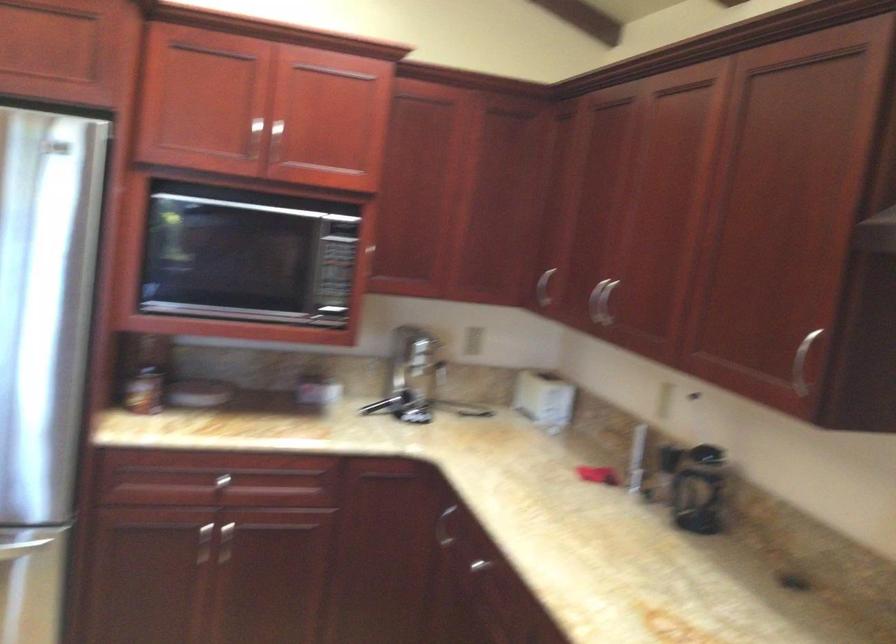
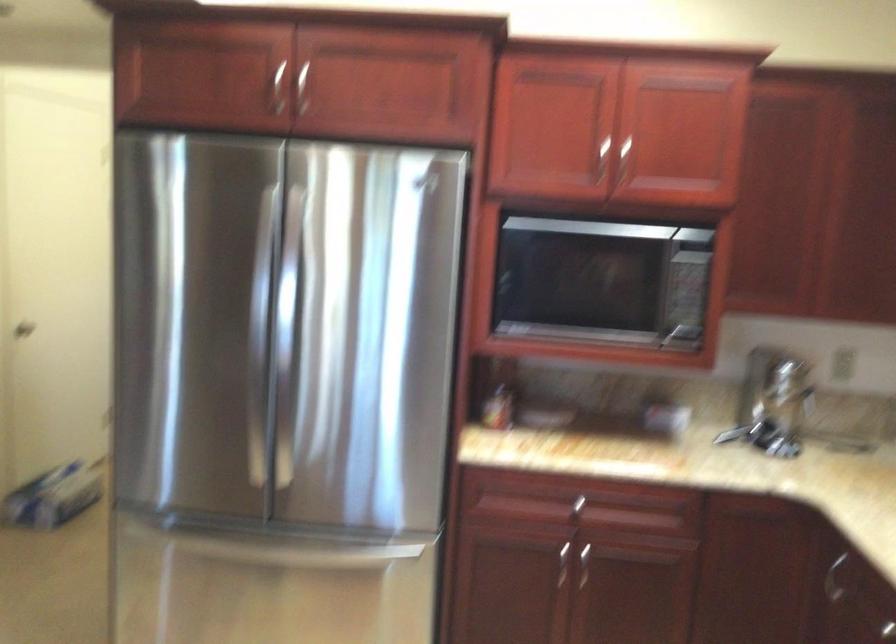
Question: The camera is either moving clockwise (left) or counter-clockwise (right) around the object. The first image is from the beginning of the video and the second image is from the end. Is the camera moving left or right when shooting the video?

Choices:
 (A) Left
 (B) Right

Answer: (B)